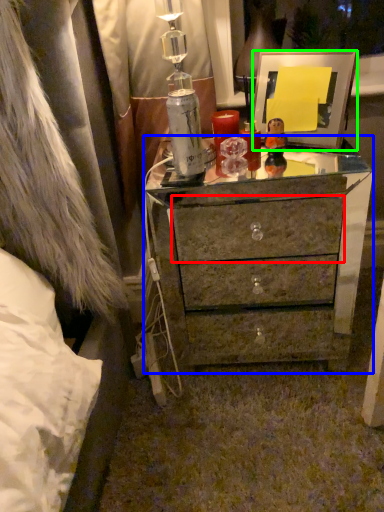
Question: Considering the real-world distances, which object is farthest from drawer (highlighted by a red box)? chest of drawers (highlighted by a blue box) or picture frame (highlighted by a green box)?

Choices:
 (A) chest of drawers
 (B) picture frame

Answer: (B)